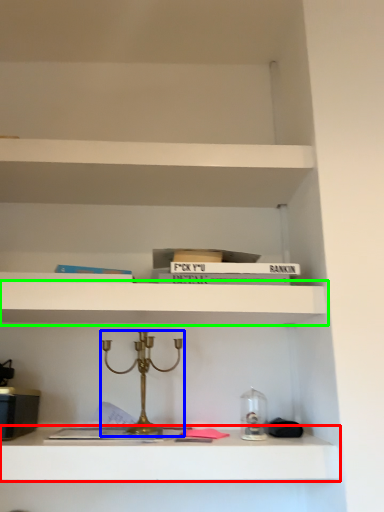
Question: Which object is positioned closest to shelf (highlighted by a red box)? Select from candle holder (highlighted by a blue box) and shelf (highlighted by a green box).

Choices:
 (A) candle holder
 (B) shelf

Answer: (A)